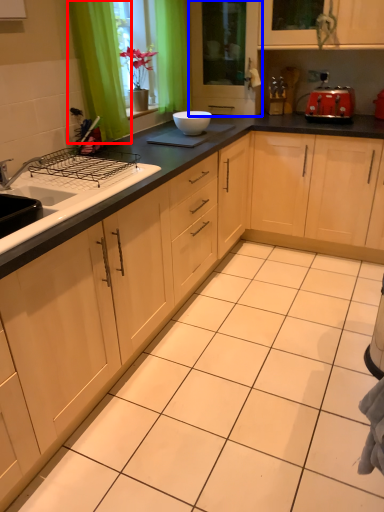
Question: Which object is further to the camera taking this photo, curtain (highlighted by a red box) or screen door (highlighted by a blue box)?

Choices:
 (A) curtain
 (B) screen door

Answer: (B)